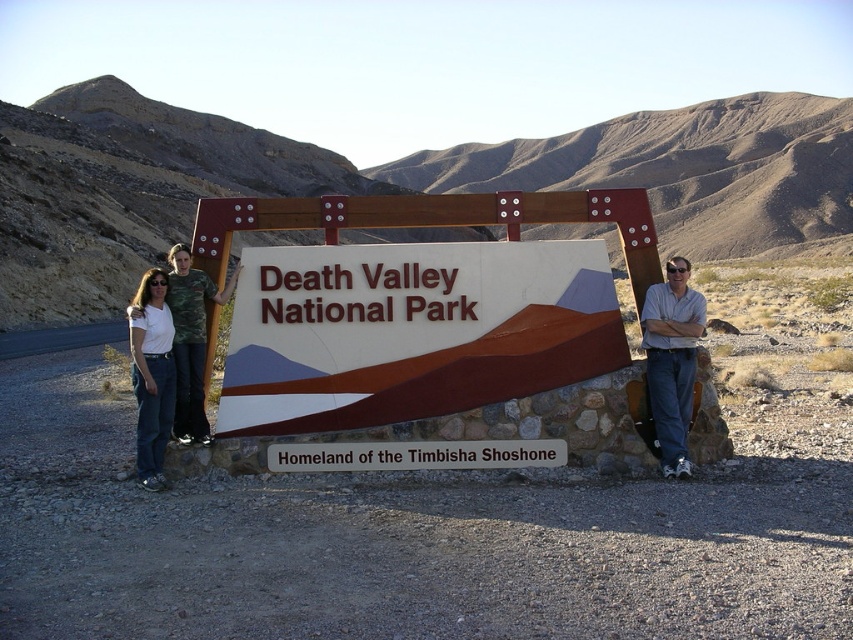
Can you confirm if light blue denim jeans at center is taller than white matte shirt at left?

Yes, light blue denim jeans at center is taller than white matte shirt at left.

Is light blue denim jeans at center wider than white matte shirt at left?

Yes, light blue denim jeans at center is wider than white matte shirt at left.

Describe the element at coordinates (672, 360) in the screenshot. I see `light blue denim jeans at center` at that location.

Where is `light blue denim jeans at center`? Image resolution: width=853 pixels, height=640 pixels. light blue denim jeans at center is located at coordinates (672, 360).

Consider the image. Does matte plastic sign at center have a lesser height compared to white cotton shirt at left?

Yes, matte plastic sign at center is shorter than white cotton shirt at left.

Is matte plastic sign at center bigger than white cotton shirt at left?

Correct, matte plastic sign at center is larger in size than white cotton shirt at left.

The height and width of the screenshot is (640, 853). Describe the element at coordinates (410, 330) in the screenshot. I see `matte plastic sign at center` at that location.

This screenshot has height=640, width=853. In order to click on matte plastic sign at center in this screenshot , I will do `click(410, 330)`.

Does white cotton shirt at left appear over white matte shirt at left?

Indeed, white cotton shirt at left is positioned over white matte shirt at left.

Locate an element on the screen. This screenshot has width=853, height=640. white cotton shirt at left is located at coordinates (172, 358).

Between point (178, 410) and point (152, 454), which one is positioned behind?

The point (178, 410) is more distant.

Find the location of a particular element. white cotton shirt at left is located at coordinates (172, 358).